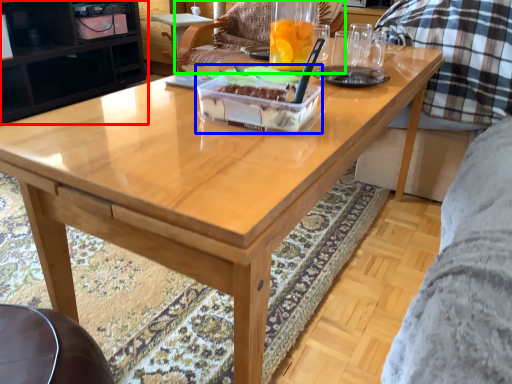
Question: Based on their relative distances, which object is farther from cabinetry (highlighted by a red box)? Choose from cake (highlighted by a blue box) and chair (highlighted by a green box).

Choices:
 (A) cake
 (B) chair

Answer: (A)